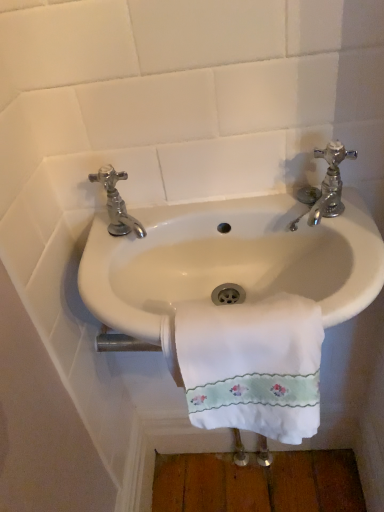
The width and height of the screenshot is (384, 512). In order to click on chrome metallic faucet at upper right, placed as the first tap when sorted from right to left in this screenshot , I will do `click(325, 186)`.

The height and width of the screenshot is (512, 384). What do you see at coordinates (250, 365) in the screenshot?
I see `white embroidered towel at center` at bounding box center [250, 365].

Identify the location of chrome metallic faucet at upper right, the 2th tap positioned from the left. The height and width of the screenshot is (512, 384). (325, 186).

How far apart are white embroidered towel at center and chrome metallic faucet at left, arranged as the 2th tap when viewed from the right?

They are 11.19 inches apart.

Is chrome metallic faucet at left, arranged as the 2th tap when viewed from the right, a part of white embroidered towel at center?

Actually, chrome metallic faucet at left, arranged as the 2th tap when viewed from the right, is outside white embroidered towel at center.

Considering the relative positions of white embroidered towel at center and chrome metallic faucet at left, arranged as the 2th tap when viewed from the right, in the image provided, is white embroidered towel at center to the right of chrome metallic faucet at left, arranged as the 2th tap when viewed from the right, from the viewer's perspective?

Yes.

From the image's perspective, which is above, white embroidered towel at center or chrome metallic faucet at left, which is the 1th tap in left-to-right order?

chrome metallic faucet at left, which is the 1th tap in left-to-right order, from the image's perspective.

Is point (275, 369) farther from camera compared to point (191, 275)?

No, (275, 369) is closer to viewer.

From the image's perspective, which one is positioned higher, white embroidered towel at center or white ceramic sink at center?

white ceramic sink at center, from the image's perspective.

Is white embroidered towel at center looking in the opposite direction of white ceramic sink at center?

Yes, white embroidered towel at center's orientation is away from white ceramic sink at center.

Is white embroidered towel at center bigger or smaller than white ceramic sink at center?

In the image, white embroidered towel at center appears to be smaller than white ceramic sink at center.

Is chrome metallic faucet at upper right, placed as the first tap when sorted from right to left, smaller than chrome metallic faucet at left, arranged as the 2th tap when viewed from the right?

Yes.

From the image's perspective, would you say chrome metallic faucet at upper right, the 2th tap positioned from the left, is shown under chrome metallic faucet at left, which is the 1th tap in left-to-right order?

No.

The height and width of the screenshot is (512, 384). Identify the location of tap that appears on the left of chrome metallic faucet at upper right, the 2th tap positioned from the left. (117, 203).

Can we say chrome metallic faucet at upper right, placed as the first tap when sorted from right to left, lies outside chrome metallic faucet at left, which is the 1th tap in left-to-right order?

Yes, chrome metallic faucet at upper right, placed as the first tap when sorted from right to left, is located beyond the bounds of chrome metallic faucet at left, which is the 1th tap in left-to-right order.

Can you confirm if white ceramic sink at center is bigger than chrome metallic faucet at left, which is the 1th tap in left-to-right order?

Correct, white ceramic sink at center is larger in size than chrome metallic faucet at left, which is the 1th tap in left-to-right order.

Between white ceramic sink at center and chrome metallic faucet at left, arranged as the 2th tap when viewed from the right, which one has smaller width?

chrome metallic faucet at left, arranged as the 2th tap when viewed from the right.

From a real-world perspective, count 2nd taps upward from the white ceramic sink at center and point to it. Please provide its 2D coordinates.

[(117, 203)]

From the picture: Is chrome metallic faucet at left, arranged as the 2th tap when viewed from the right, beside white ceramic sink at center?

chrome metallic faucet at left, arranged as the 2th tap when viewed from the right, is not next to white ceramic sink at center, and they're not touching.

Is chrome metallic faucet at left, arranged as the 2th tap when viewed from the right, positioned with its back to white ceramic sink at center?

That's not correct — chrome metallic faucet at left, arranged as the 2th tap when viewed from the right, is not looking away from white ceramic sink at center.

Is point (107, 165) positioned in front of point (188, 261)?

Yes, it is in front of point (188, 261).

Does chrome metallic faucet at left, arranged as the 2th tap when viewed from the right, appear on the left side of white ceramic sink at center?

Yes, chrome metallic faucet at left, arranged as the 2th tap when viewed from the right, is to the left of white ceramic sink at center.

From a real-world perspective, is chrome metallic faucet at left, arranged as the 2th tap when viewed from the right, located higher than white embroidered towel at center?

Correct, in the physical world, chrome metallic faucet at left, arranged as the 2th tap when viewed from the right, is higher than white embroidered towel at center.

Is chrome metallic faucet at left, which is the 1th tap in left-to-right order, oriented towards white embroidered towel at center?

No, chrome metallic faucet at left, which is the 1th tap in left-to-right order, is not turned towards white embroidered towel at center.

Considering the sizes of objects chrome metallic faucet at left, which is the 1th tap in left-to-right order, and white embroidered towel at center in the image provided, who is bigger, chrome metallic faucet at left, which is the 1th tap in left-to-right order, or white embroidered towel at center?

white embroidered towel at center.

Considering the sizes of chrome metallic faucet at upper right, placed as the first tap when sorted from right to left, and white embroidered towel at center in the image, is chrome metallic faucet at upper right, placed as the first tap when sorted from right to left, taller or shorter than white embroidered towel at center?

Considering their sizes, chrome metallic faucet at upper right, placed as the first tap when sorted from right to left, has less height than white embroidered towel at center.

How distant is chrome metallic faucet at upper right, the 2th tap positioned from the left, from white embroidered towel at center?

They are 24.81 centimeters apart.

Is chrome metallic faucet at upper right, placed as the first tap when sorted from right to left, facing away from white embroidered towel at center?

No.

What's the angular difference between chrome metallic faucet at upper right, the 2th tap positioned from the left, and white embroidered towel at center's facing directions?

0.00272 degrees separate the facing orientations of chrome metallic faucet at upper right, the 2th tap positioned from the left, and white embroidered towel at center.

In the image, there is a chrome metallic faucet at left, arranged as the 2th tap when viewed from the right. Where is `towel/napkin below it (from the image's perspective)`? towel/napkin below it (from the image's perspective) is located at coordinates (250, 365).

Where is `towel/napkin located on the right of white ceramic sink at center`? Image resolution: width=384 pixels, height=512 pixels. towel/napkin located on the right of white ceramic sink at center is located at coordinates (250, 365).

Based on their spatial positions, is white ceramic sink at center or white embroidered towel at center closer to chrome metallic faucet at left, arranged as the 2th tap when viewed from the right?

white ceramic sink at center is closer to chrome metallic faucet at left, arranged as the 2th tap when viewed from the right.

From the image, which object appears to be nearer to chrome metallic faucet at upper right, placed as the first tap when sorted from right to left, white ceramic sink at center or white embroidered towel at center?

Based on the image, white ceramic sink at center appears to be nearer to chrome metallic faucet at upper right, placed as the first tap when sorted from right to left.

Estimate the real-world distances between objects in this image. Which object is closer to white embroidered towel at center, chrome metallic faucet at upper right, the 2th tap positioned from the left, or white ceramic sink at center?

white ceramic sink at center is closer to white embroidered towel at center.

Considering their positions, is white embroidered towel at center positioned closer to chrome metallic faucet at left, which is the 1th tap in left-to-right order, than chrome metallic faucet at upper right, placed as the first tap when sorted from right to left?

Based on the image, white embroidered towel at center appears to be nearer to chrome metallic faucet at left, which is the 1th tap in left-to-right order.

Estimate the real-world distances between objects in this image. Which object is further from white ceramic sink at center, chrome metallic faucet at left, arranged as the 2th tap when viewed from the right, or white embroidered towel at center?

chrome metallic faucet at left, arranged as the 2th tap when viewed from the right, lies further to white ceramic sink at center than the other object.

When comparing their distances from chrome metallic faucet at upper right, the 2th tap positioned from the left, does chrome metallic faucet at left, arranged as the 2th tap when viewed from the right, or white embroidered towel at center seem further?

The object further to chrome metallic faucet at upper right, the 2th tap positioned from the left, is chrome metallic faucet at left, arranged as the 2th tap when viewed from the right.

Which object lies further to the anchor point chrome metallic faucet at upper right, placed as the first tap when sorted from right to left, white ceramic sink at center or chrome metallic faucet at left, arranged as the 2th tap when viewed from the right?

chrome metallic faucet at left, arranged as the 2th tap when viewed from the right, is positioned further to the anchor chrome metallic faucet at upper right, placed as the first tap when sorted from right to left.

Which object lies nearer to the anchor point chrome metallic faucet at upper right, the 2th tap positioned from the left, chrome metallic faucet at left, which is the 1th tap in left-to-right order, or white ceramic sink at center?

white ceramic sink at center lies closer to chrome metallic faucet at upper right, the 2th tap positioned from the left, than the other object.

At what (x,y) coordinates should I click in order to perform the action: click on sink between chrome metallic faucet at left, which is the 1th tap in left-to-right order, and chrome metallic faucet at upper right, placed as the first tap when sorted from right to left, in the horizontal direction. Please return your answer as a coordinate pair (x, y). The image size is (384, 512). Looking at the image, I should click on (230, 260).

Locate an element on the screen. The height and width of the screenshot is (512, 384). towel/napkin situated between chrome metallic faucet at left, which is the 1th tap in left-to-right order, and chrome metallic faucet at upper right, placed as the first tap when sorted from right to left, from left to right is located at coordinates (250, 365).

Find the location of a particular element. sink between chrome metallic faucet at upper right, placed as the first tap when sorted from right to left, and white embroidered towel at center vertically is located at coordinates (230, 260).

You are a GUI agent. You are given a task and a screenshot of the screen. Output one action in this format:
    pyautogui.click(x=<x>, y=<y>)
    Task: Click on the sink between chrome metallic faucet at left, arranged as the 2th tap when viewed from the right, and white embroidered towel at center vertically
    Image resolution: width=384 pixels, height=512 pixels.
    Given the screenshot: What is the action you would take?
    pyautogui.click(x=230, y=260)